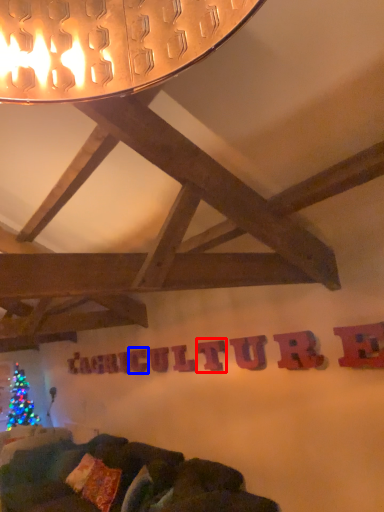
Question: Among these objects, which one is nearest to the camera, letter (highlighted by a red box) or letter (highlighted by a blue box)?

Choices:
 (A) letter
 (B) letter

Answer: (A)